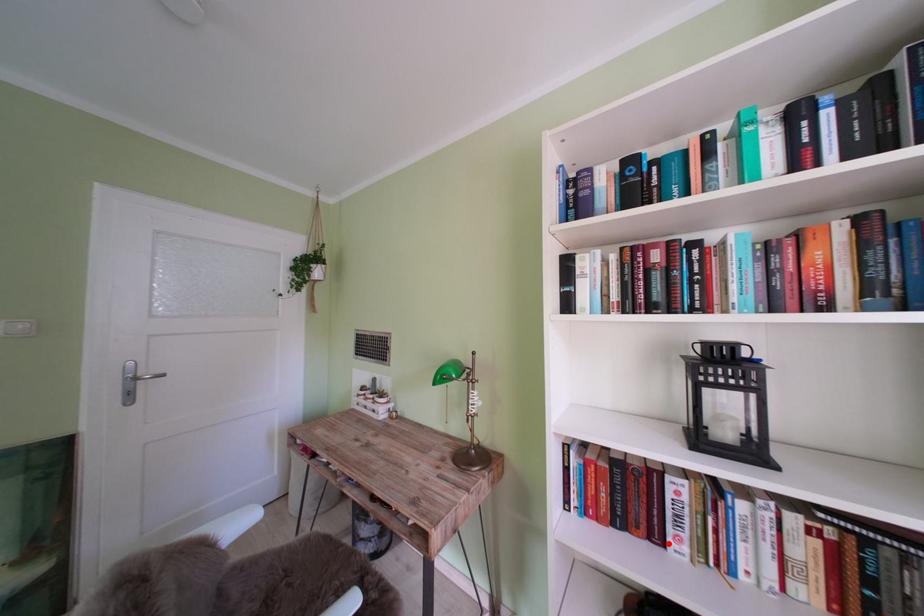
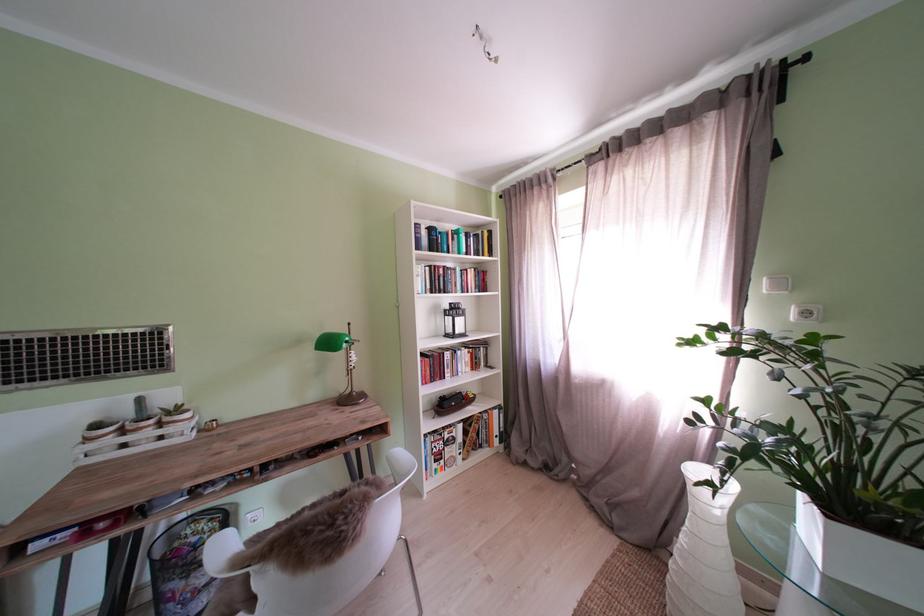
In the second image, find the point that corresponds to the highlighted location in the first image.

(454, 382)